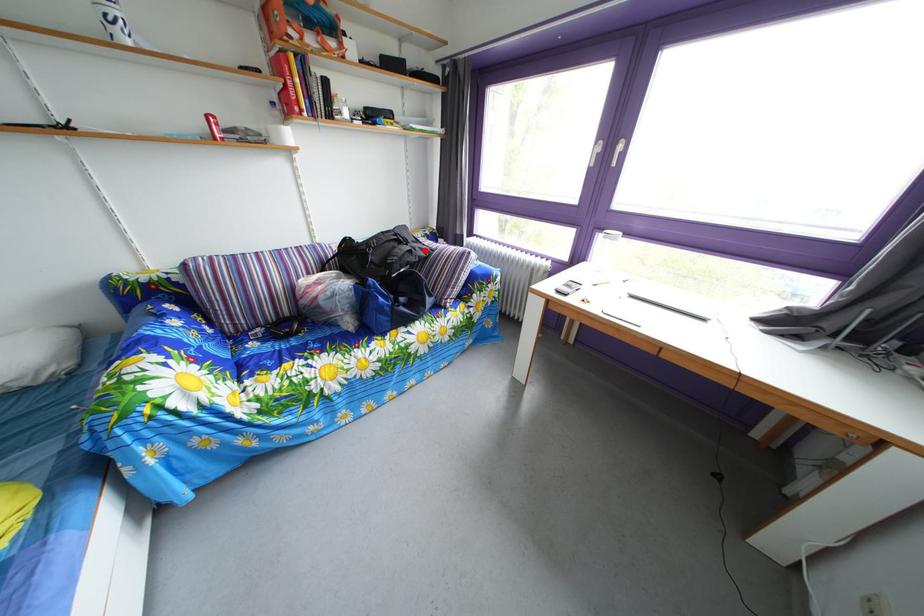
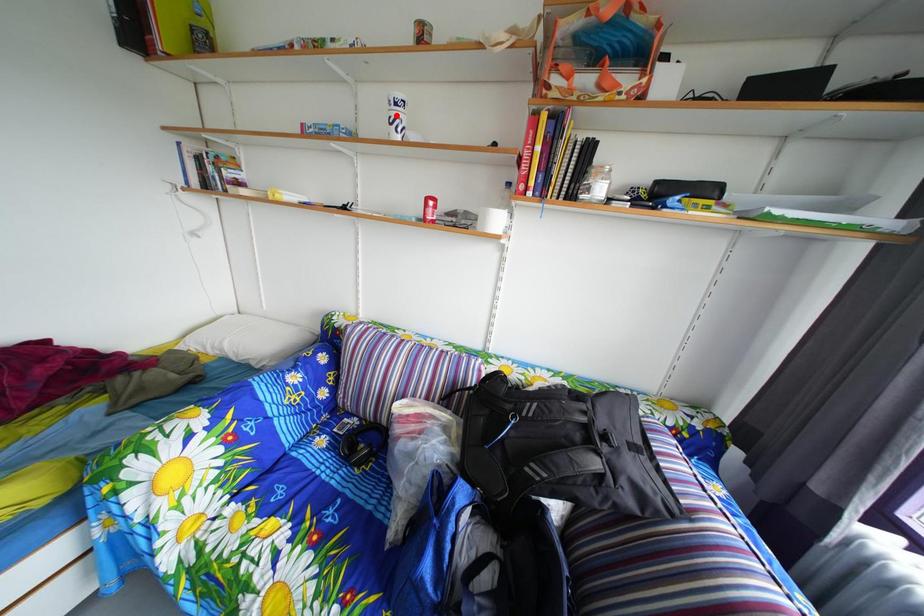
I am providing you with two images of the same scene from different viewpoints. A red point is marked on the first image and another point is marked on the second image. Do the highlighted points in image1 and image2 indicate the same real-world spot?

No